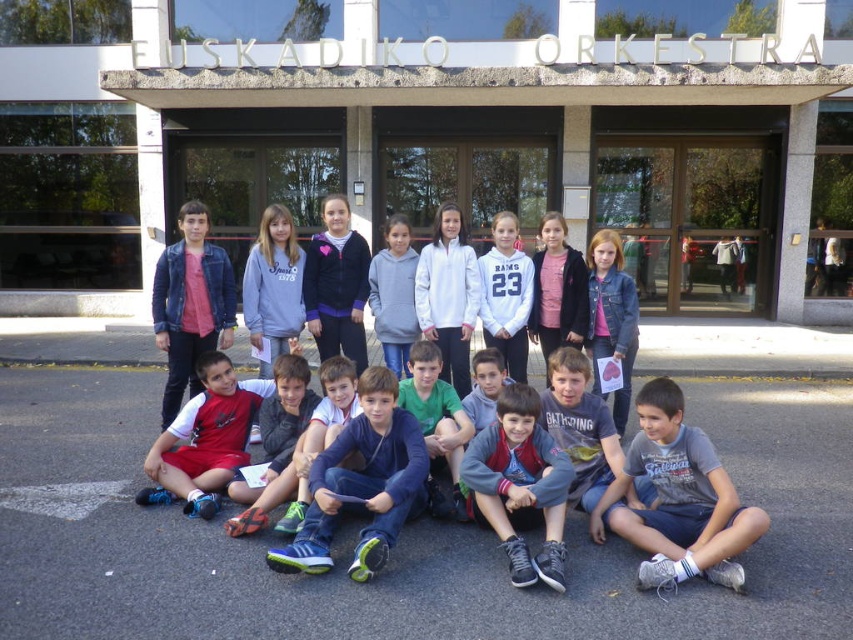
You are a photographer trying to capture a closeup of the purple fleece jacket at center and the denim jacket at center. Which jacket should you move your camera towards to get a closer shot?

To capture a closeup, move the camera towards the purple fleece jacket at center since it is closer to the viewer compared to the denim jacket at center.

You are a photographer trying to capture a group photo of the children in front of the EUSKADIKO ORKESTRA building. You need to ensure that the gray cotton shirt at lower right and the white matte jacket at center are both visible in the frame. Which child should you position closer to the camera to ensure their clothing items are clearly visible?

A: The gray cotton shirt at lower right is wider than the white matte jacket at center. To ensure both are clearly visible, position the gray cotton shirt at lower right slightly farther from the camera so that its larger width doesn

Looking at this image, you are a photographer trying to focus on the purple fleece jacket at center. Based on the coordinates provided, is the jacket positioned closer to the top or bottom of the image?

The purple fleece jacket at center is located at point 0.445 on the vertical axis. Since 0.445 is less than 0.5, it is closer to the bottom of the image.